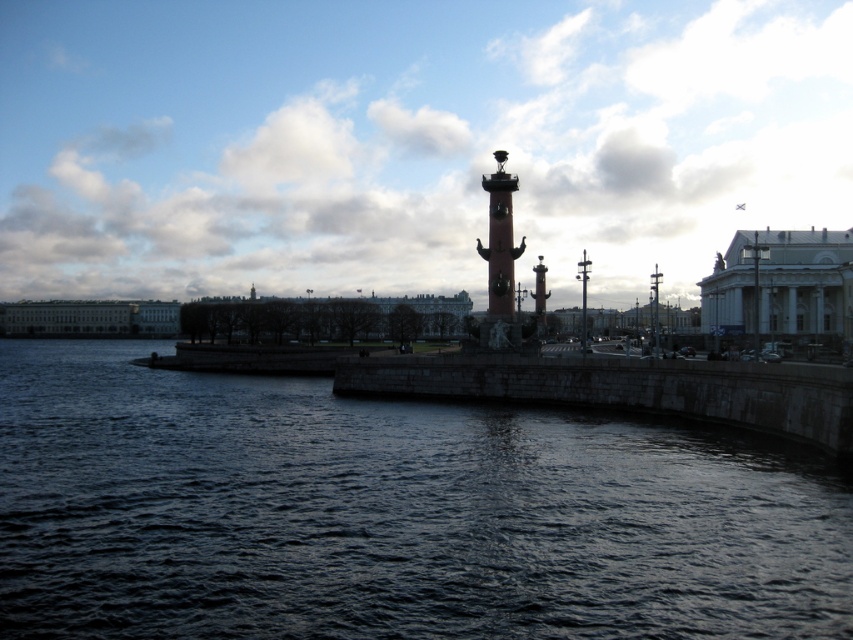
Question: Does dark stone water at center have a larger size compared to polished bronze bell tower at center?

Choices:
 (A) yes
 (B) no

Answer: (A)

Question: Observing the image, what is the correct spatial positioning of dark stone water at center in reference to polished bronze bell tower at center?

Choices:
 (A) right
 (B) left

Answer: (B)

Question: Which point is closer to the camera taking this photo?

Choices:
 (A) (503, 342)
 (B) (672, 525)

Answer: (B)

Question: Does dark stone water at center have a smaller size compared to polished bronze bell tower at center?

Choices:
 (A) yes
 (B) no

Answer: (B)

Question: Which point is farther from the camera taking this photo?

Choices:
 (A) (752, 605)
 (B) (492, 339)

Answer: (B)